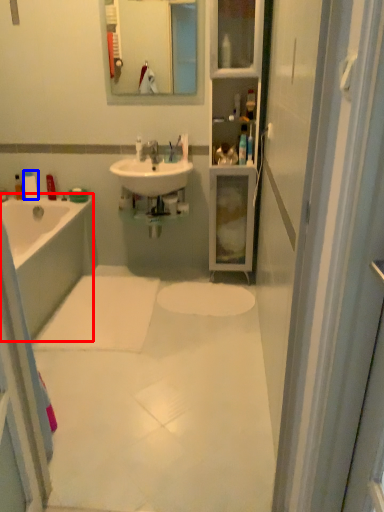
Question: Which of the following is the farthest to the observer, bathtub (highlighted by a red box) or toiletry (highlighted by a blue box)?

Choices:
 (A) bathtub
 (B) toiletry

Answer: (B)